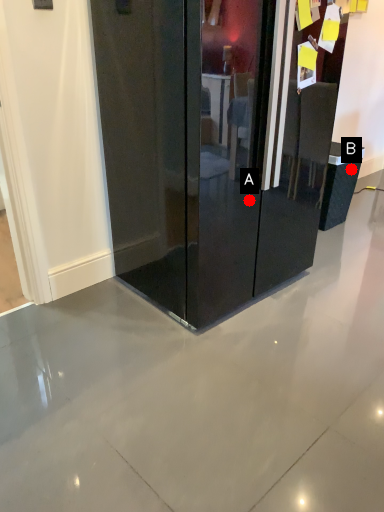
Question: Two points are circled on the image, labeled by A and B beside each circle. Which point is closer to the camera?

Choices:
 (A) A is closer
 (B) B is closer

Answer: (A)